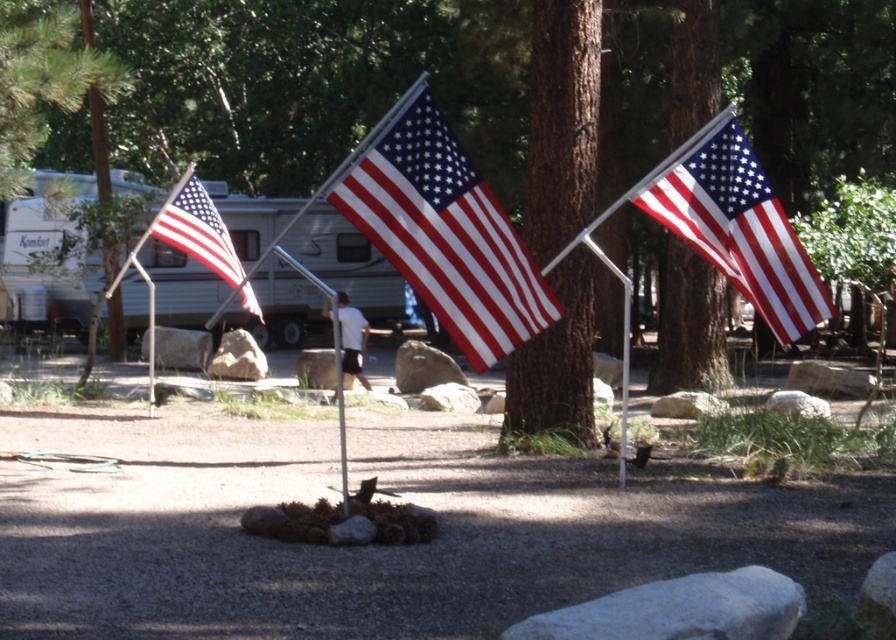
Question: Does white plastic camper at left appear on the right side of white cotton shirt at center?

Choices:
 (A) yes
 (B) no

Answer: (B)

Question: Which point is closer to the camera taking this photo?

Choices:
 (A) (703, 108)
 (B) (502, 29)

Answer: (A)

Question: Is brown rough bark tree at center further to the viewer compared to metallic silver pole at center?

Choices:
 (A) no
 (B) yes

Answer: (B)

Question: Which point is farther to the camera?

Choices:
 (A) brown textured tree at center
 (B) matte fabric flag at center
 (C) smooth bark tree at center
 (D) matte fabric flag at upper right

Answer: (C)

Question: Can you confirm if white plastic camper at center is wider than smooth bark tree at center?

Choices:
 (A) yes
 (B) no

Answer: (A)

Question: Which point is closer to the camera?

Choices:
 (A) (356, 356)
 (B) (166, 204)
 (C) (711, 124)
 (D) (540, 278)

Answer: (D)